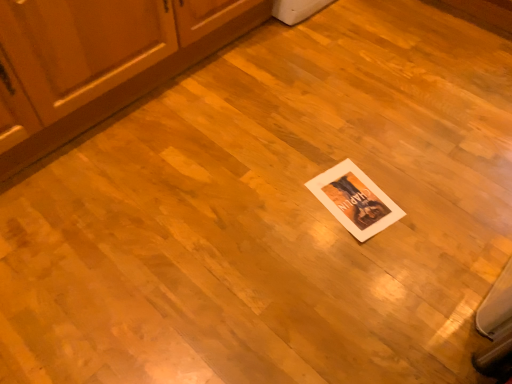
Locate an element on the screen. wooden cabinet at lower left is located at coordinates (105, 57).

Describe the element at coordinates (105, 57) in the screenshot. I see `wooden cabinet at lower left` at that location.

Identify the location of wooden cabinet at lower left. The height and width of the screenshot is (384, 512). (105, 57).